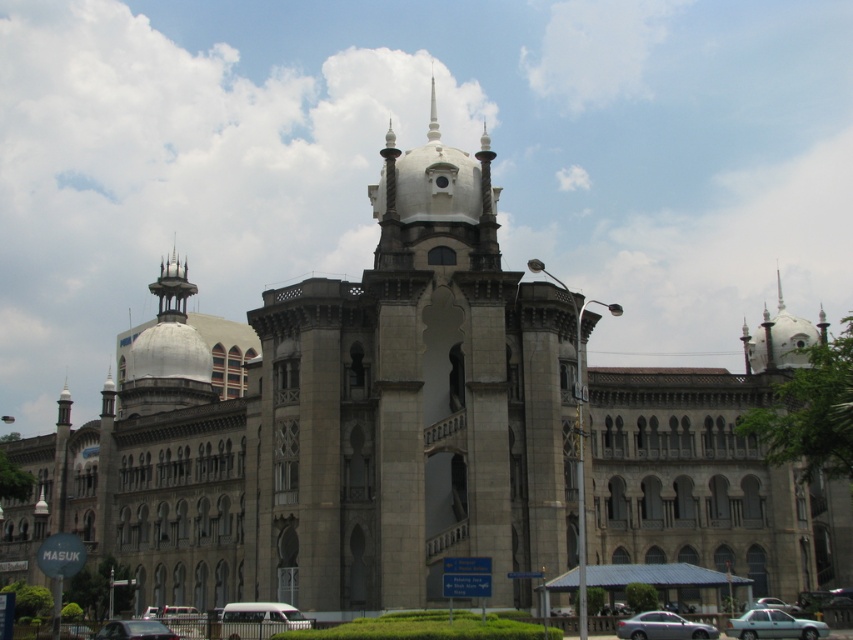
You are standing at the entrance of the grand architectural structure and want to park your car. Where should you drive to park the satin silver sedan at lower center?

The satin silver sedan at lower center should be parked at the location corresponding to the coordinates point (663, 627).

You are a delivery person trying to park your 2.5 meters wide truck. You see the satin silver sedan at lower center at point (663, 627). Is there enough space to park your truck next to it?

The satin silver sedan at lower center at point (663, 627) is 4.5 meters wide. Since your truck is 2.5 meters wide, there is enough space to park next to it as long as the total available width is more than 7 meters.

You are a parking attendant who needs to fit both the light blue metallic car at lower right and the satin silver sedan at lower center into a parking spot that is only tall enough for vehicles up to 1.6 meters in height. Based on the scene, can both cars fit in the spot?

The light blue metallic car at lower right is taller than the satin silver sedan at lower center. Since the parking spot is only tall enough for vehicles up to 1.6 meters, the light blue metallic car at lower right may not fit, but the satin silver sedan at lower center could potentially fit if its height is within the limit.